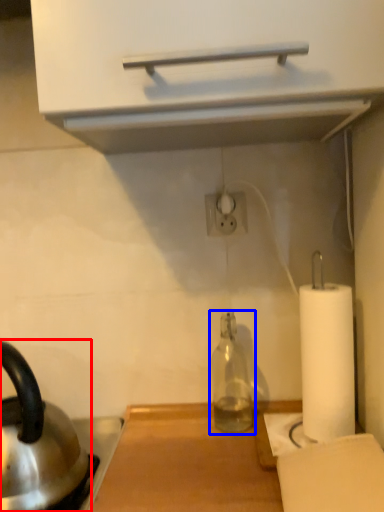
Question: Which point is closer to the camera, kettle (highlighted by a red box) or bottle (highlighted by a blue box)?

Choices:
 (A) kettle
 (B) bottle

Answer: (A)